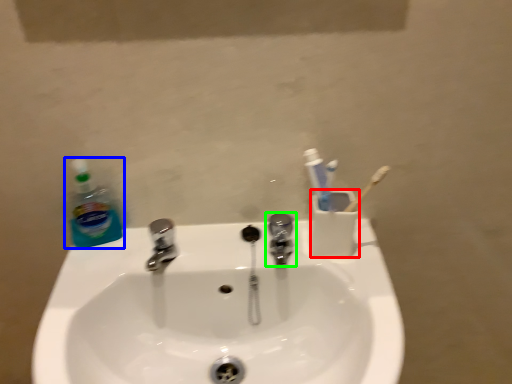
Question: Which object is the farthest from liquid (highlighted by a red box)? Choose among these: cleaning product (highlighted by a blue box) or tap (highlighted by a green box).

Choices:
 (A) cleaning product
 (B) tap

Answer: (A)